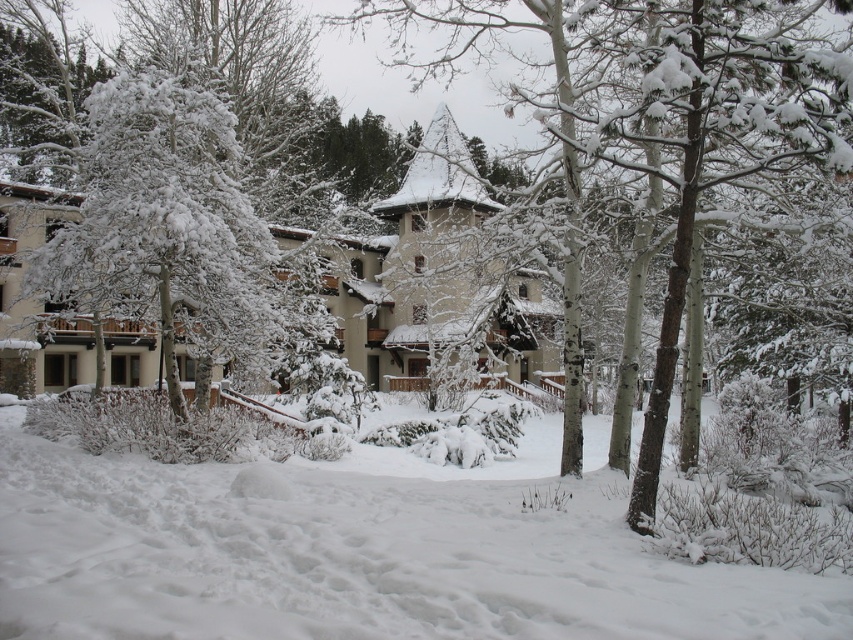
Question: Is snow-covered tree at center thinner than white snow-covered tree at left?

Choices:
 (A) no
 (B) yes

Answer: (A)

Question: Which point is closer to the camera?

Choices:
 (A) white snow-covered tree at left
 (B) snow-covered tree at center

Answer: (B)

Question: Can you confirm if snow-covered tree at center is positioned below white snow-covered tree at left?

Choices:
 (A) no
 (B) yes

Answer: (A)

Question: Among these objects, which one is farthest from the camera?

Choices:
 (A) white snow-covered tree at left
 (B) snow-covered tree at center

Answer: (A)

Question: Does white fluffy snow at center come in front of snow-covered tree at center?

Choices:
 (A) no
 (B) yes

Answer: (B)

Question: Estimate the real-world distances between objects in this image. Which object is closer to the snow-covered tree at center?

Choices:
 (A) white fluffy snow at center
 (B) white snow-covered tree at left

Answer: (B)